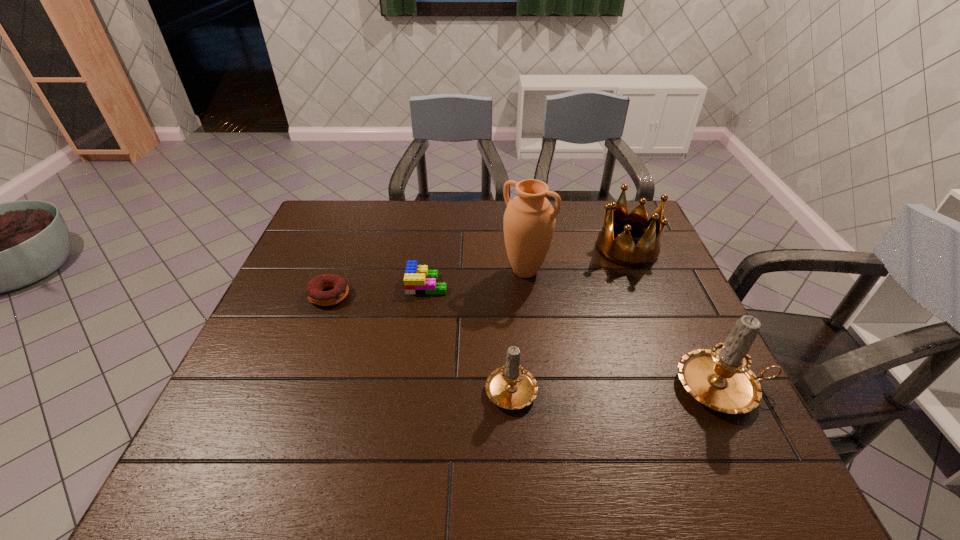
Image resolution: width=960 pixels, height=540 pixels. I want to click on free space that satisfies the following two spatial constraints: 1. on the back side of the shorter candle; 2. on the left side of the crown, so [x=502, y=248].

The height and width of the screenshot is (540, 960). I want to click on free point that satisfies the following two spatial constraints: 1. on the front side of the shortest object; 2. on the left side of the shorter candle, so click(295, 387).

I want to click on vacant area in the image that satisfies the following two spatial constraints: 1. on the back side of the crown; 2. on the right side of the shortest object, so click(x=347, y=248).

Identify the location of blank area in the image that satisfies the following two spatial constraints: 1. on the back side of the crown; 2. on the right side of the fourth tallest object. (502, 248).

At what (x,y) coordinates should I click in order to perform the action: click on free spot that satisfies the following two spatial constraints: 1. on the front side of the urn; 2. on the right side of the taller candle. Please return your answer as a coordinate pair (x, y). Looking at the image, I should click on (539, 387).

I want to click on vacant region that satisfies the following two spatial constraints: 1. on the front side of the shorter candle; 2. on the right side of the leftmost object, so click(x=295, y=387).